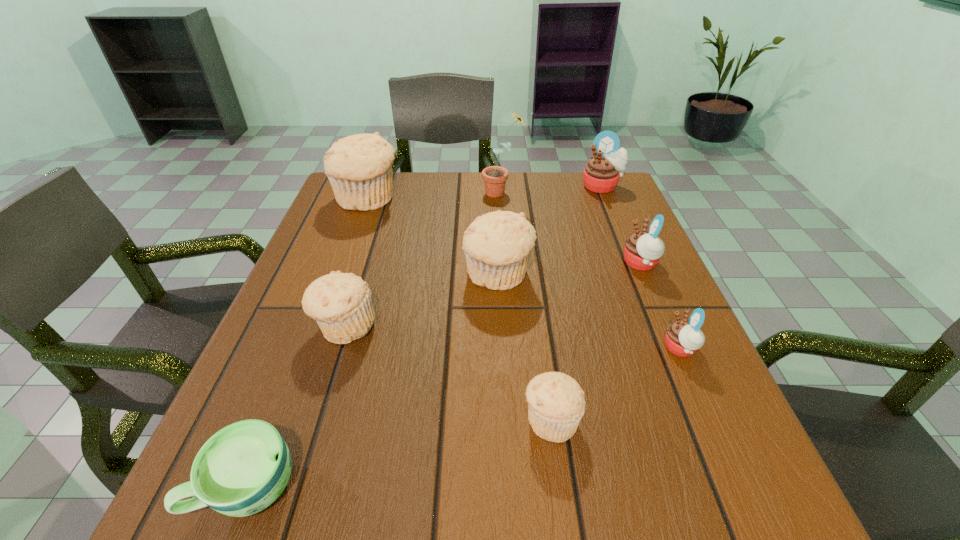
You are a GUI agent. You are given a task and a screenshot of the screen. Output one action in this format:
    pyautogui.click(x=<x>, y=<y>)
    Task: Click on the vacant point located 0.160m on the back of the second smallest beige muffin
    This screenshot has width=960, height=540.
    Given the screenshot: What is the action you would take?
    pyautogui.click(x=368, y=255)

I want to click on vacant space located 0.140m on the front-facing side of the nearest pink muffin, so click(x=586, y=348).

Identify the location of vacant space located on the front-facing side of the nearest pink muffin. (546, 348).

You are a GUI agent. You are given a task and a screenshot of the screen. Output one action in this format:
    pyautogui.click(x=<x>, y=<y>)
    Task: Click on the vacant space situated on the front-facing side of the nearest pink muffin
    
    Given the screenshot: What is the action you would take?
    pyautogui.click(x=590, y=348)

The height and width of the screenshot is (540, 960). Identify the location of free space located on the back of the smallest beige muffin. (529, 257).

Identify the location of vacant point located on the right of the blue cup. (428, 487).

In order to click on sunflower positioned at the far edge in this screenshot , I will do `click(494, 177)`.

At what (x,y) coordinates should I click in order to perform the action: click on object present at the near edge. Please return your answer as a coordinate pair (x, y). Looking at the image, I should click on (243, 468).

In order to click on cup that is at the left edge in this screenshot , I will do `click(243, 468)`.

Find the location of a particular element. The image size is (960, 540). object that is positioned at the far left corner is located at coordinates (359, 167).